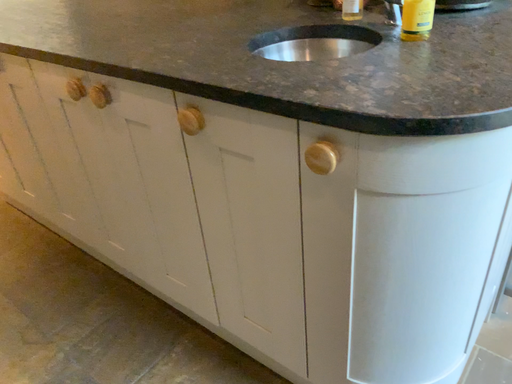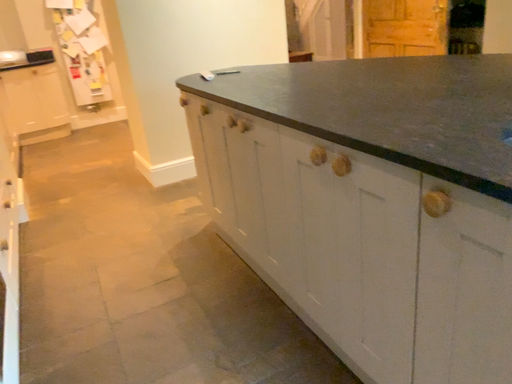
Question: Which way did the camera rotate in the video?

Choices:
 (A) rotated left
 (B) rotated right

Answer: (A)